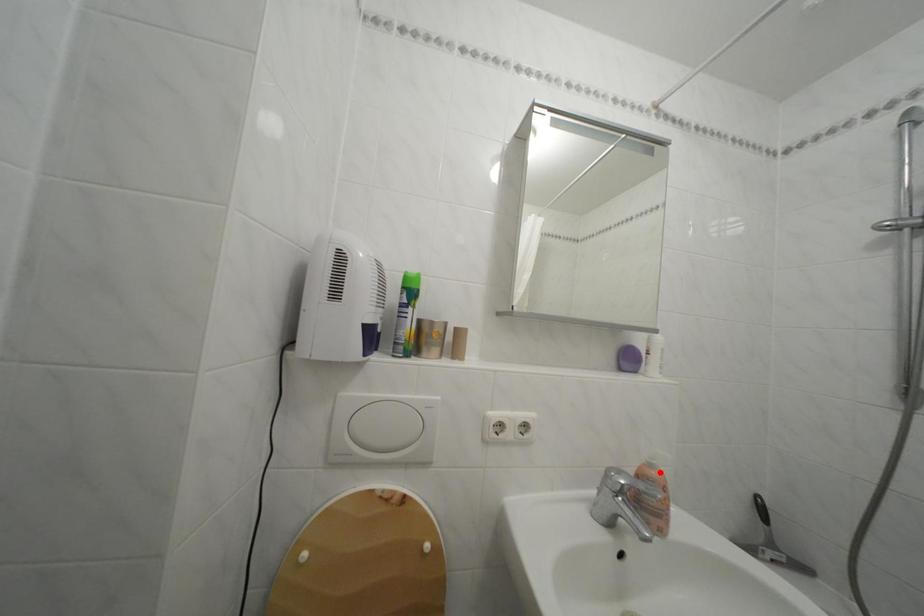
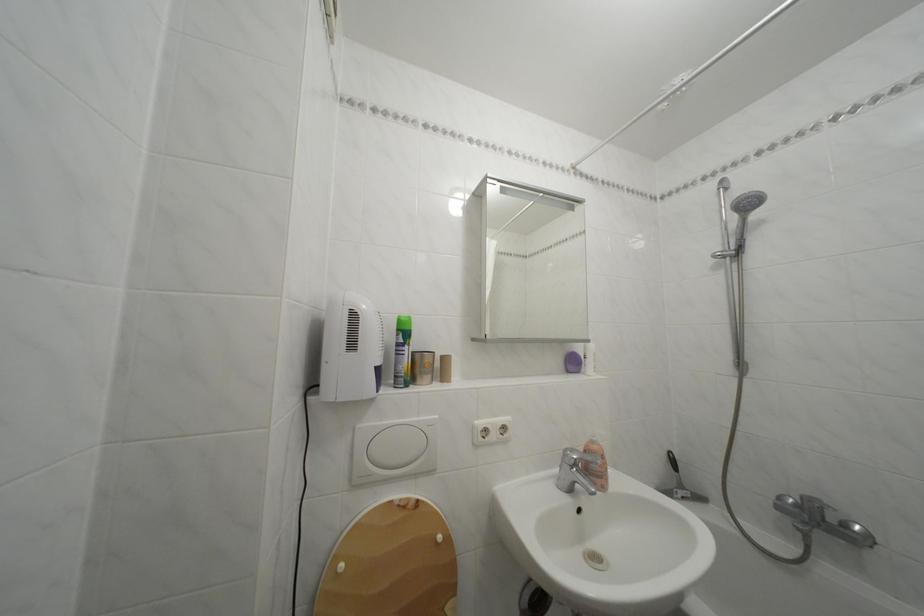
Locate, in the second image, the point that corresponds to the highlighted location in the first image.

(602, 448)